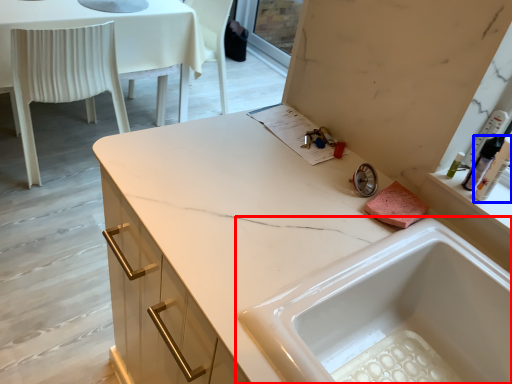
Question: Which point is closer to the camera, sink (highlighted by a red box) or toiletry (highlighted by a blue box)?

Choices:
 (A) sink
 (B) toiletry

Answer: (A)